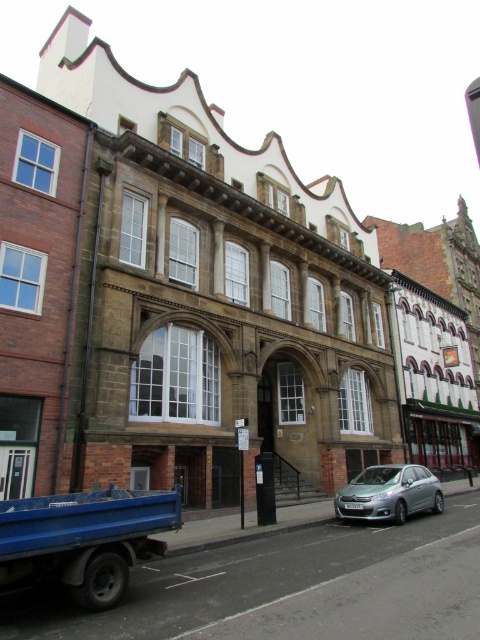
Who is more forward, (31,545) or (432,474)?

Answer: Positioned in front is point (31,545).

Who is taller, blue matte truck at lower left or satin silver car at lower center?

satin silver car at lower center

Describe the element at coordinates (84, 540) in the screenshot. I see `blue matte truck at lower left` at that location.

Where is `blue matte truck at lower left`? blue matte truck at lower left is located at coordinates (84, 540).